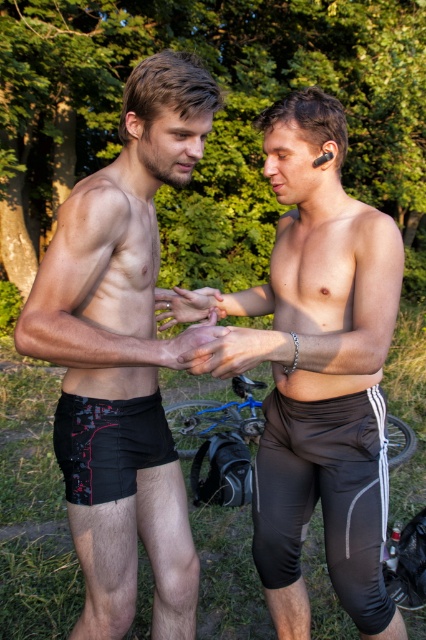
Who is taller, matte black shorts at center or black printed shorts at lower left?

With more height is matte black shorts at center.

Does matte black shorts at center have a smaller size compared to black printed shorts at lower left?

No.

Between point (264, 141) and point (115, 488), which one is positioned in front?

Point (115, 488) is in front.

This screenshot has width=426, height=640. In order to click on matte black shorts at center in this screenshot , I will do `click(322, 372)`.

Between smooth skin hands at center and smooth skin hand at center, which one appears on the right side from the viewer's perspective?

smooth skin hands at center

Does smooth skin hands at center have a smaller size compared to smooth skin hand at center?

Indeed, smooth skin hands at center has a smaller size compared to smooth skin hand at center.

Who is more forward, (226, 365) or (222, 332)?

Point (226, 365)

Identify the location of smooth skin hands at center. (229, 353).

Can you confirm if black matte shorts at left is thinner than blue metallic bicycle at center?

Correct, black matte shorts at left's width is less than blue metallic bicycle at center's.

Is point (120, 333) farther from viewer compared to point (181, 451)?

No.

Where is `black matte shorts at left`? black matte shorts at left is located at coordinates (121, 356).